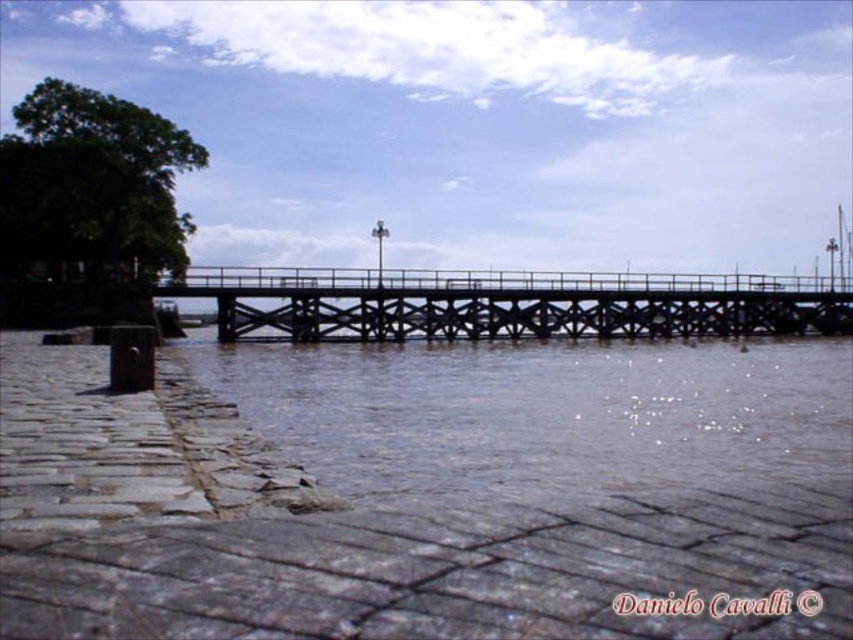
You are standing at the camera position and want to reach the point at coordinates (306, 376). The path is straight but has a slight incline. If your maximum walking distance is 90 meters, will you be able to reach the point without exceeding your limit?

The point at coordinates (306, 376) is 89.43 meters away from the camera position. Since this distance is less than your maximum walking distance of 90 meters, you can reach the point without exceeding your limit.

You are standing at the point marked by the coordinates point (538, 412) in the riverside scene. What type of water do you see around you?

The point (538, 412) indicates brown muddy water at center, so you are surrounded by brown muddy water at center.